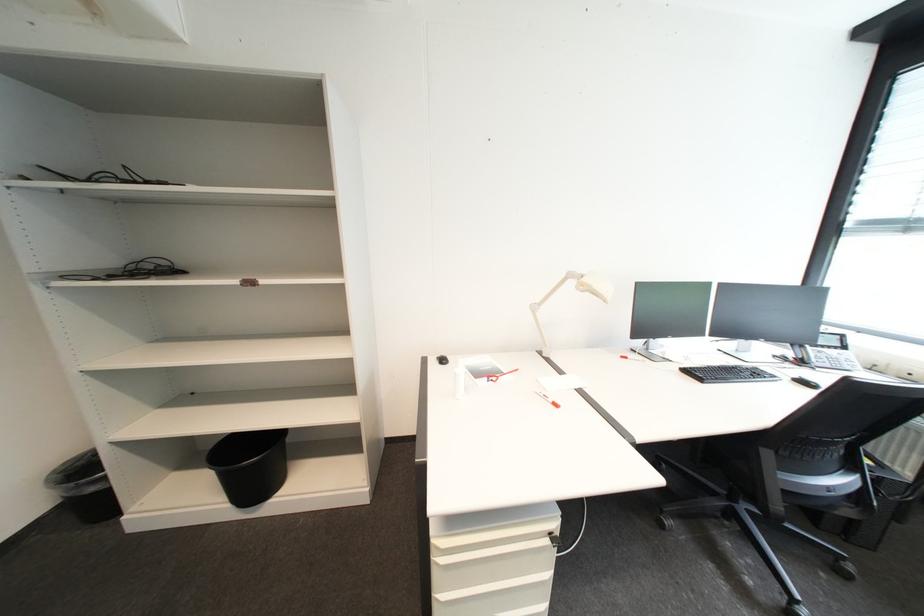
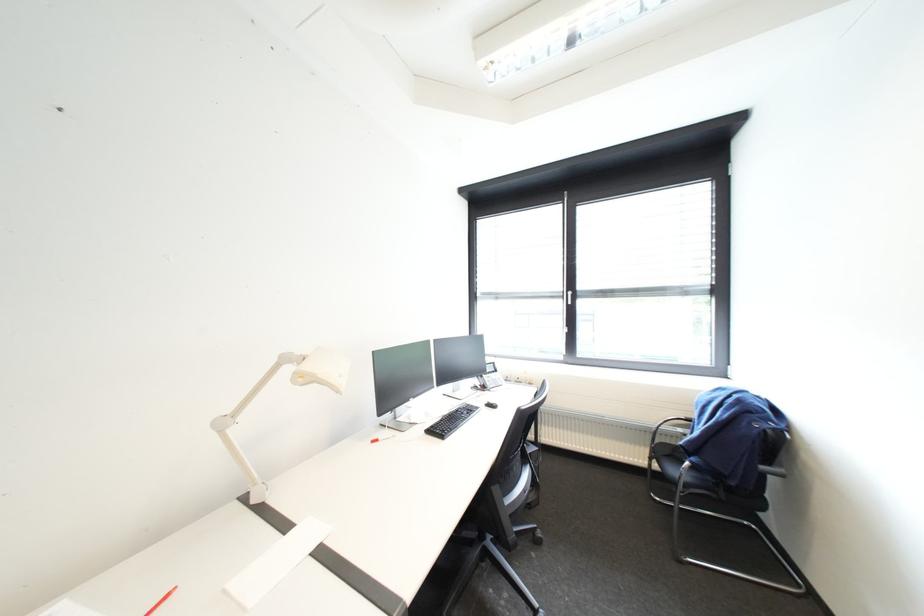
Question: How did the camera likely rotate?

Choices:
 (A) Left
 (B) Right
 (C) Up
 (D) Down

Answer: (B)